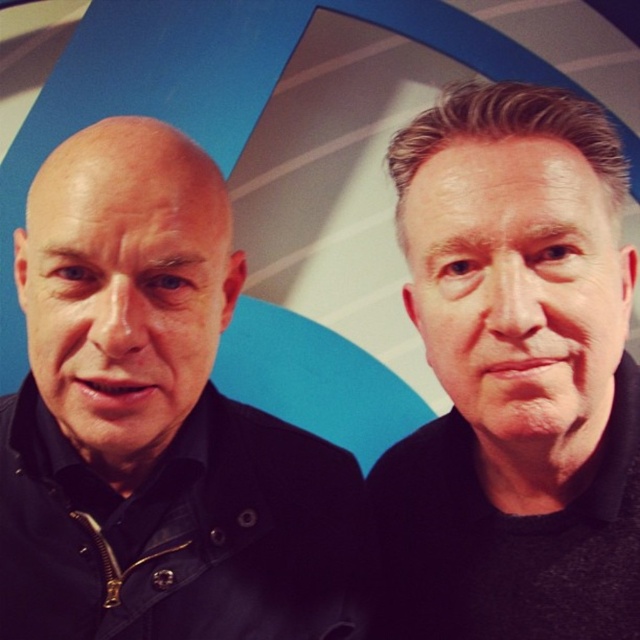
Looking at this image, you are a photographer adjusting your camera settings to capture the scene. You notice the black matte jacket at left and the smooth skin face at right. Which object should you focus on first to ensure proper depth of field?

The black matte jacket at left is closer to the viewer than the smooth skin face at right, so focusing on it first will ensure the depth of field captures both subjects properly.

You are holding a small drone that has a maximum flight range of 18 inches. You want to fly it from your current position to the point marked at coordinates point (496, 180) in the image. Based on the scene description, can your drone reach that point?

The point (496, 180) is 18.94 inches away from the viewer, which is slightly beyond the drone maximum flight range of 18 inches. Therefore, the drone cannot reach that point.

You are an artist trying to sketch this scene. You need to ensure the proportions are accurate. Which of the two faces, the smooth skin face at right or the bald head at left, should you draw as taller?

The bald head at left should be drawn as taller since the smooth skin face at right has a lesser height compared to it.